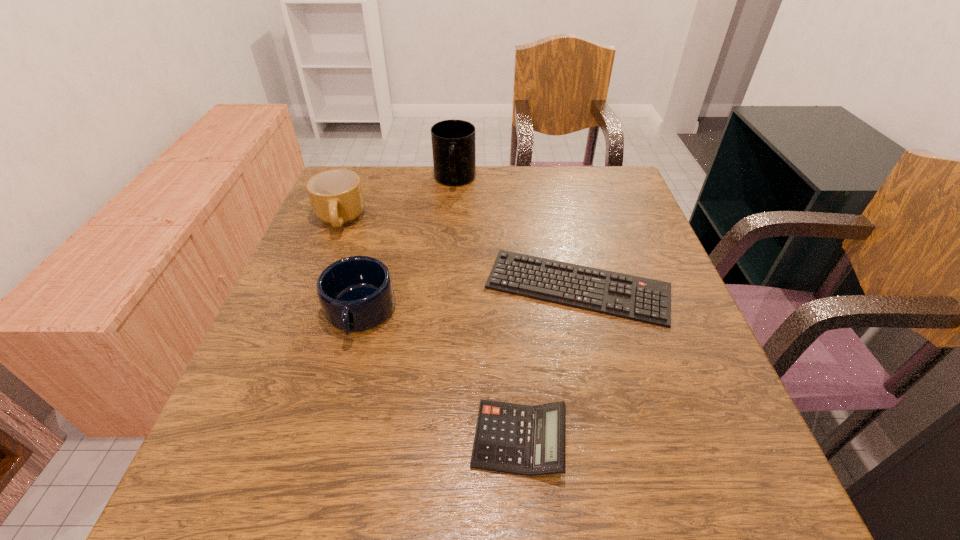
The height and width of the screenshot is (540, 960). I want to click on free space between the nearest mug and the nearest object, so click(x=440, y=376).

This screenshot has width=960, height=540. Identify the location of free space between the computer keyboard and the farthest mug. (516, 234).

Identify the location of free space between the nearest object and the shortest object. The height and width of the screenshot is (540, 960). (548, 363).

Find the location of a particular element. The width and height of the screenshot is (960, 540). free point between the computer keyboard and the farthest mug is located at coordinates (516, 234).

Where is `empty location between the second shortest object and the second farthest mug`? empty location between the second shortest object and the second farthest mug is located at coordinates (429, 329).

Identify the location of vacant area that lies between the calculator and the nearest mug. (440, 376).

Identify which object is the third closest to the shortest object. Please provide its 2D coordinates. Your answer should be formatted as a tuple, i.e. [(x, y)], where the tuple contains the x and y coordinates of a point satisfying the conditions above.

[(453, 141)]

Find the location of a particular element. This screenshot has height=540, width=960. the fourth closest object to the fourth tallest object is located at coordinates (453, 141).

Locate an element on the screen. Image resolution: width=960 pixels, height=540 pixels. mug that is the nearest to the tallest mug is located at coordinates (336, 196).

Locate which mug is the second closest to the tallest object. Please provide its 2D coordinates. Your answer should be formatted as a tuple, i.e. [(x, y)], where the tuple contains the x and y coordinates of a point satisfying the conditions above.

[(356, 293)]